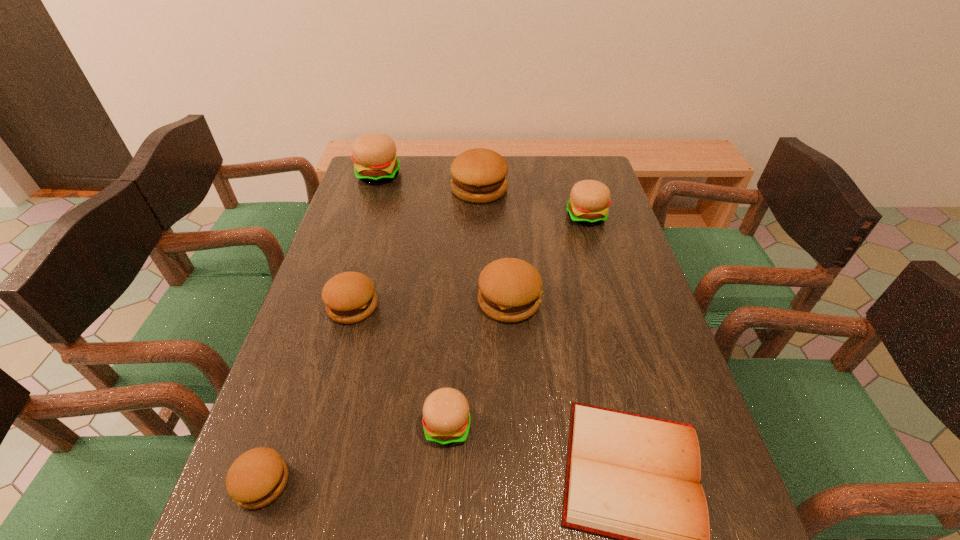
Identify which brown hamburger is the second closest to the third biggest brown hamburger. Please provide its 2D coordinates. Your answer should be formatted as a tuple, i.e. [(x, y)], where the tuple contains the x and y coordinates of a point satisfying the conditions above.

[(256, 478)]

Identify the location of free point that satisfies the following two spatial constraints: 1. on the front side of the third smallest brown hamburger; 2. on the left side of the leftmost beige hamburger. Image resolution: width=960 pixels, height=540 pixels. (339, 301).

This screenshot has width=960, height=540. Identify the location of blank space that satisfies the following two spatial constraints: 1. on the back side of the nearest brown hamburger; 2. on the right side of the biggest brown hamburger. (363, 189).

Where is `vacant space that satisfies the following two spatial constraints: 1. on the back side of the second smallest beige hamburger; 2. on the right side of the third biggest brown hamburger`? This screenshot has height=540, width=960. vacant space that satisfies the following two spatial constraints: 1. on the back side of the second smallest beige hamburger; 2. on the right side of the third biggest brown hamburger is located at coordinates (378, 217).